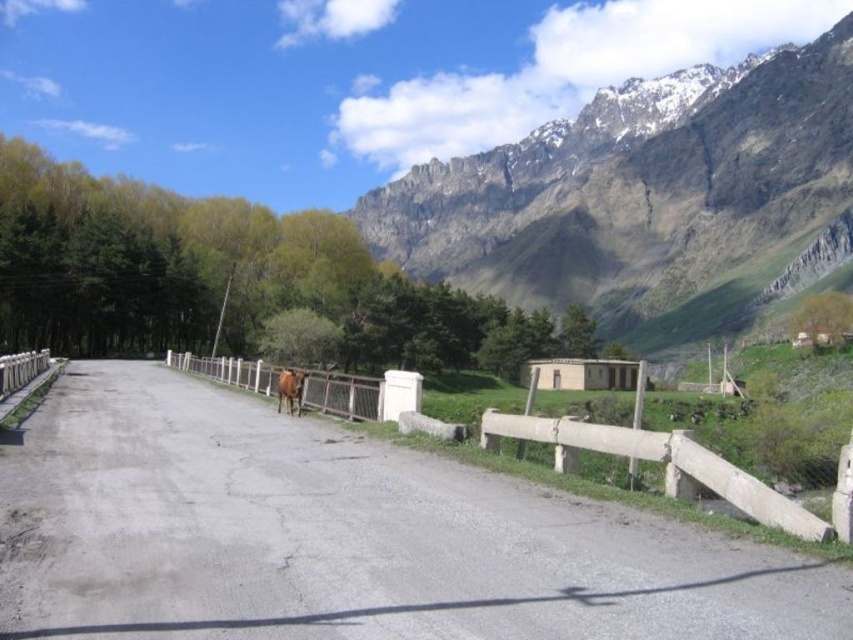
Question: Does gray asphalt road at center appear on the left side of rugged stone mountain at upper right?

Choices:
 (A) no
 (B) yes

Answer: (B)

Question: Is gray asphalt road at center to the right of brown glossy horse at center from the viewer's perspective?

Choices:
 (A) no
 (B) yes

Answer: (B)

Question: Considering the real-world distances, which object is closest to the rugged stone mountain at upper right?

Choices:
 (A) brown glossy horse at center
 (B) gray asphalt road at center

Answer: (B)

Question: Estimate the real-world distances between objects in this image. Which object is farther from the gray asphalt road at center?

Choices:
 (A) rugged stone mountain at upper right
 (B) brown glossy horse at center

Answer: (A)

Question: Which point is closer to the camera?

Choices:
 (A) brown glossy horse at center
 (B) gray asphalt road at center

Answer: (B)

Question: Does gray asphalt road at center have a greater width compared to rugged stone mountain at upper right?

Choices:
 (A) yes
 (B) no

Answer: (B)